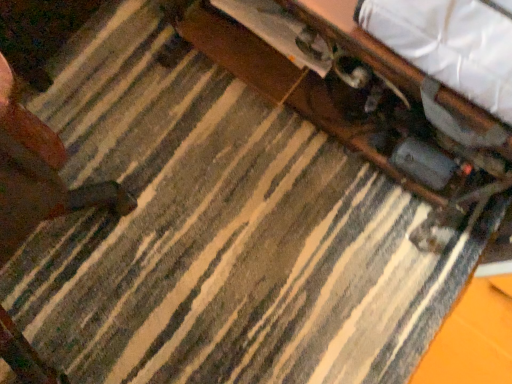
At what (x,y) coordinates should I click in order to perform the action: click on wooden drawer at upper center. Please return your answer as a coordinate pair (x, y). Image resolution: width=512 pixels, height=384 pixels. Looking at the image, I should click on coord(237,49).

What do you see at coordinates (237, 49) in the screenshot? I see `wooden drawer at upper center` at bounding box center [237, 49].

Measure the distance between point (395, 121) and camera.

A distance of 36.54 inches exists between point (395, 121) and camera.

In the scene shown: What is the approximate width of white fabric at upper right?

It is 8.31 inches.

You are a GUI agent. You are given a task and a screenshot of the screen. Output one action in this format:
    pyautogui.click(x=<x>, y=<y>)
    Task: Click on the wooden drawer at upper center
    The height and width of the screenshot is (384, 512).
    Given the screenshot: What is the action you would take?
    pyautogui.click(x=237, y=49)

What's the angular difference between wooden drawer at upper center and wooden table at center's facing directions?

They differ by 0.261 degrees in their facing directions.

From a real-world perspective, is wooden drawer at upper center over wooden table at center?

No, from a real-world perspective, wooden drawer at upper center is not above wooden table at center.

Is wooden drawer at upper center at the right side of wooden table at center?

No, wooden drawer at upper center is not to the right of wooden table at center.

Is wooden drawer at upper center touching white fabric at upper right?

wooden drawer at upper center and white fabric at upper right are clearly separated.

From the image's perspective, does wooden drawer at upper center appear lower than white fabric at upper right?

No, from the image's perspective, wooden drawer at upper center is not below white fabric at upper right.

Looking at this image, is wooden drawer at upper center looking in the opposite direction of white fabric at upper right?

No.

Is wooden drawer at upper center to the left of white fabric at upper right from the viewer's perspective?

Yes, wooden drawer at upper center is to the left of white fabric at upper right.

Which of these two, wooden table at center or wooden drawer at upper center, is bigger?

wooden table at center is bigger.

Is wooden table at center not within wooden drawer at upper center?

wooden table at center is positioned outside wooden drawer at upper center.

From a real-world perspective, is wooden table at center physically below wooden drawer at upper center?

Incorrect, from a real-world perspective, wooden table at center is higher than wooden drawer at upper center.

Based on the photo, from the image's perspective, is wooden table at center below wooden drawer at upper center?

Correct, wooden table at center appears lower than wooden drawer at upper center in the image.

Considering the relative positions of white fabric at upper right and wooden drawer at upper center in the image provided, is white fabric at upper right to the right of wooden drawer at upper center from the viewer's perspective?

Correct, you'll find white fabric at upper right to the right of wooden drawer at upper center.

Does white fabric at upper right turn towards wooden drawer at upper center?

No, white fabric at upper right is not oriented towards wooden drawer at upper center.

From the image's perspective, does white fabric at upper right appear higher than wooden drawer at upper center?

Actually, white fabric at upper right appears below wooden drawer at upper center in the image.

This screenshot has width=512, height=384. I want to click on drawer behind the white fabric at upper right, so click(237, 49).

Is wooden table at center inside the boundaries of white fabric at upper right, or outside?

wooden table at center exists outside the volume of white fabric at upper right.

Identify the location of table behind the white fabric at upper right. This screenshot has height=384, width=512. (356, 100).

How different are the orientations of wooden table at center and white fabric at upper right in degrees?

0.00017 degrees.

Who is shorter, wooden table at center or white fabric at upper right?

With less height is white fabric at upper right.

Based on the photo, would you say wooden table at center is part of white fabric at upper right's contents?

No, wooden table at center is not a part of white fabric at upper right.

From the image's perspective, is white fabric at upper right located beneath wooden table at center?

Yes, from the image's perspective, white fabric at upper right is below wooden table at center.

Is point (484, 101) behind point (415, 172)?

That is False.

Image resolution: width=512 pixels, height=384 pixels. In the image, there is a wooden table at center. Find the location of `drawer below it (from a real-world perspective)`. drawer below it (from a real-world perspective) is located at coordinates (237, 49).

This screenshot has width=512, height=384. Find the location of `sheet located below the wooden drawer at upper center (from the image's perspective)`. sheet located below the wooden drawer at upper center (from the image's perspective) is located at coordinates (449, 45).

Looking at the image, which one is located closer to wooden drawer at upper center, white fabric at upper right or wooden table at center?

wooden table at center is closer to wooden drawer at upper center.

Estimate the real-world distances between objects in this image. Which object is closer to wooden table at center, white fabric at upper right or wooden drawer at upper center?

The object closer to wooden table at center is wooden drawer at upper center.

Looking at the image, which one is located further to wooden drawer at upper center, wooden table at center or white fabric at upper right?

white fabric at upper right lies further to wooden drawer at upper center than the other object.

When comparing their distances from white fabric at upper right, does wooden drawer at upper center or wooden table at center seem further?

wooden drawer at upper center is positioned further to the anchor white fabric at upper right.

Looking at this image, when comparing their distances from white fabric at upper right, does wooden table at center or wooden drawer at upper center seem further?

wooden drawer at upper center is further to white fabric at upper right.

Considering their positions, is wooden drawer at upper center positioned further to wooden table at center than white fabric at upper right?

The object further to wooden table at center is white fabric at upper right.

The image size is (512, 384). Identify the location of table positioned between white fabric at upper right and wooden drawer at upper center from near to far. (356, 100).